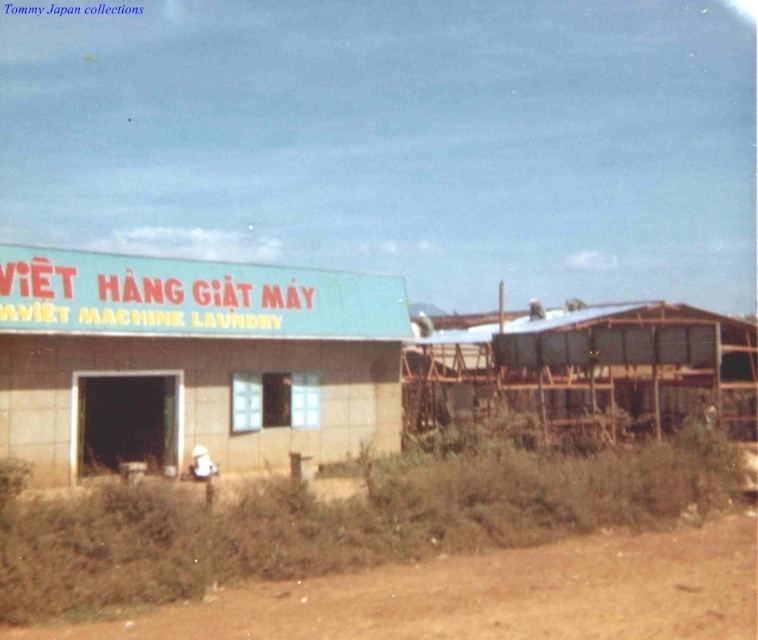
Question: Observing the image, what is the correct spatial positioning of brown dirt track at lower center in reference to metal/wooden hut at right?

Choices:
 (A) left
 (B) right

Answer: (A)

Question: Does beige concrete hut at center appear on the right side of brown dirt track at lower center?

Choices:
 (A) no
 (B) yes

Answer: (A)

Question: Which point is farther from the camera taking this photo?

Choices:
 (A) (735, 321)
 (B) (280, 420)
 (C) (606, 620)

Answer: (A)

Question: Where is brown dirt track at lower center located in relation to metal/wooden hut at right in the image?

Choices:
 (A) left
 (B) right

Answer: (A)

Question: Considering the real-world distances, which object is farthest from the brown dirt track at lower center?

Choices:
 (A) beige concrete hut at center
 (B) metal/wooden hut at right

Answer: (B)

Question: Which of the following is the closest to the observer?

Choices:
 (A) (421, 611)
 (B) (481, 337)
 (C) (14, 449)

Answer: (A)